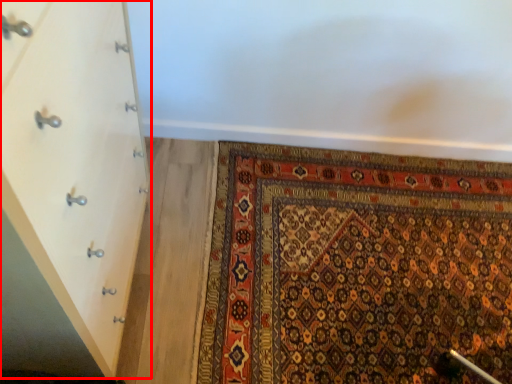
Question: From the image's perspective, what is the correct spatial relationship of chest of drawers (annotated by the red box) in relation to mat?

Choices:
 (A) below
 (B) above

Answer: (B)